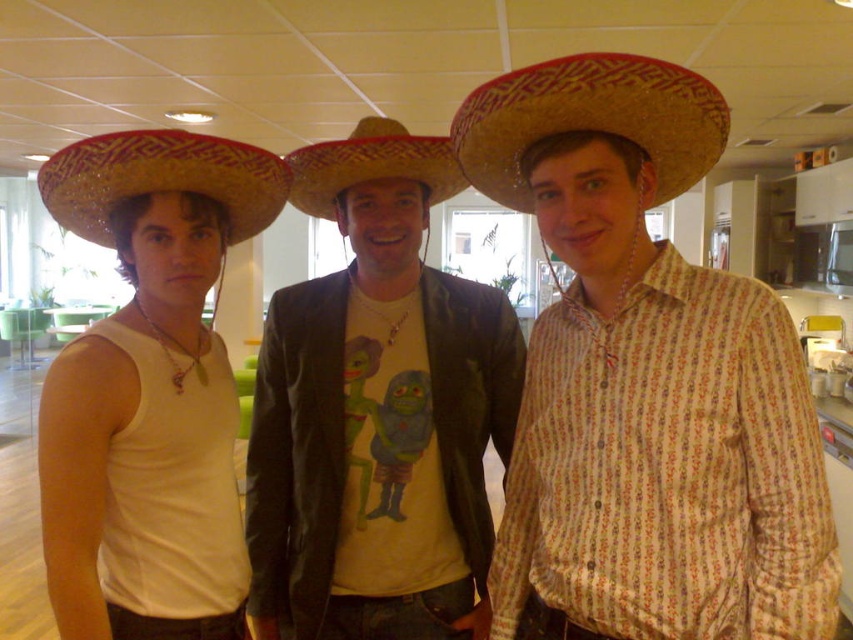
Can you confirm if matte straw sombrero at center is smaller than matte brown leather jacket at center?

Incorrect, matte straw sombrero at center is not smaller in size than matte brown leather jacket at center.

Who is more distant from viewer, (651,269) or (331,428)?

The point (331,428) is more distant.

Is point (566, 362) positioned before point (392, 324)?

Yes, point (566, 362) is closer to viewer.

The height and width of the screenshot is (640, 853). I want to click on matte straw sombrero at center, so click(645, 380).

Can you confirm if matte straw sombrero at left is wider than bright straw sombrero at left?

No, matte straw sombrero at left is not wider than bright straw sombrero at left.

Does matte straw sombrero at left have a larger size compared to bright straw sombrero at left?

Yes.

What are the coordinates of `matte straw sombrero at left` in the screenshot? It's located at pos(173,298).

Which of these two, matte straw sombrero at left or straw woven sombrero at center, stands shorter?

straw woven sombrero at center is shorter.

The width and height of the screenshot is (853, 640). What do you see at coordinates (173, 298) in the screenshot?
I see `matte straw sombrero at left` at bounding box center [173, 298].

Describe the element at coordinates (173, 298) in the screenshot. The image size is (853, 640). I see `matte straw sombrero at left` at that location.

This screenshot has width=853, height=640. In order to click on matte straw sombrero at left in this screenshot , I will do `click(173, 298)`.